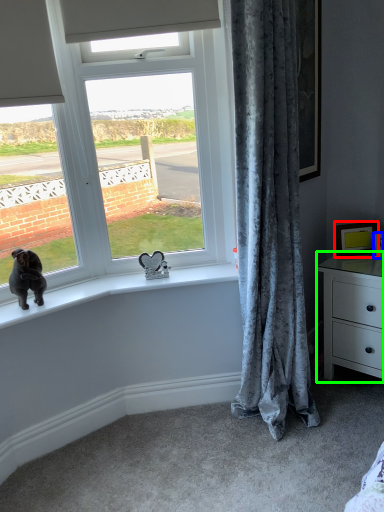
Question: Which is farther away from picture frame (highlighted by a red box)? picture frame (highlighted by a blue box) or chest of drawers (highlighted by a green box)?

Choices:
 (A) picture frame
 (B) chest of drawers

Answer: (B)